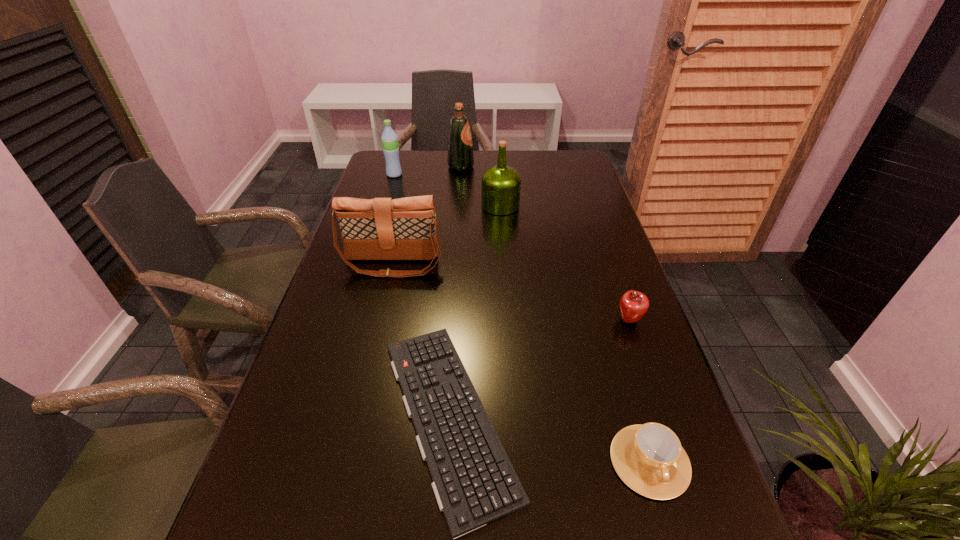
Where is `the farther olive oil`? the farther olive oil is located at coordinates (460, 158).

This screenshot has width=960, height=540. Find the location of `the third farthest object`. the third farthest object is located at coordinates (501, 184).

You are a GUI agent. You are given a task and a screenshot of the screen. Output one action in this format:
    pyautogui.click(x=<x>, y=<y>)
    Task: Click on the right olive oil
    The image size is (960, 540).
    Given the screenshot: What is the action you would take?
    coord(501,184)

The width and height of the screenshot is (960, 540). I want to click on water bottle, so click(x=389, y=138).

Identify the location of the fourth farthest object. (405, 228).

Identify the location of apple. This screenshot has height=540, width=960. (633, 305).

Identify the location of the fifth tallest object. This screenshot has width=960, height=540. (633, 305).

Identify the location of cup. The width and height of the screenshot is (960, 540). (649, 458).

Where is `computer keyboard`? The image size is (960, 540). computer keyboard is located at coordinates (475, 483).

Where is `free space located 0.340m on the front-facing side of the farther olive oil`? free space located 0.340m on the front-facing side of the farther olive oil is located at coordinates (566, 167).